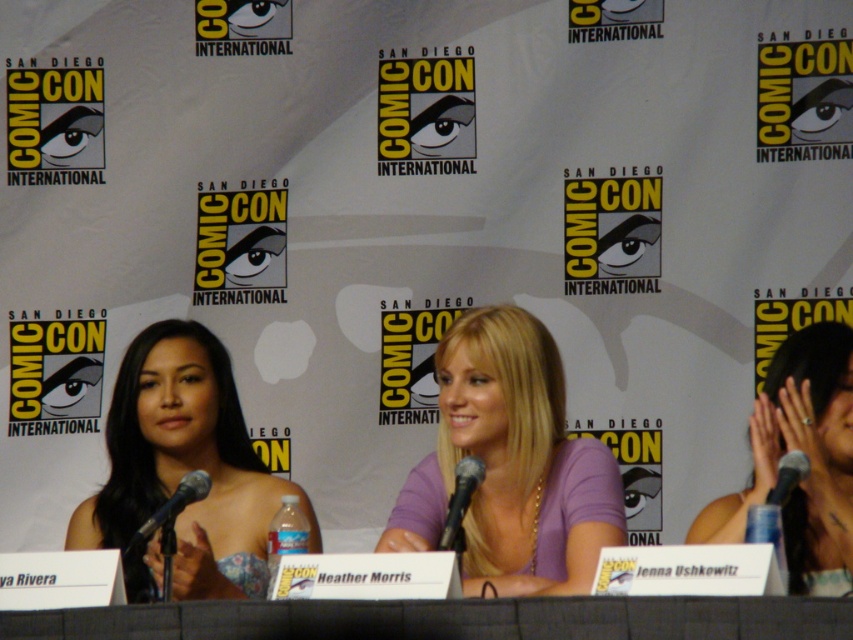
You are attending San Diego Comic Con and want to take a photo of the two points mentioned in the scene. Which point is closer to you, point (573, 621) or point (165, 502)?

Point (573, 621) is closer to the viewer than point (165, 502).

You are a photographer positioned at the back of the room and want to capture a clear shot of both the black metallic microphone at left and the black matte microphone at center. Which microphone will appear closer to you in the photo?

The black metallic microphone at left will appear closer to you in the photo because it is positioned closer to your vantage point compared to the black matte microphone at center, which is farther away.